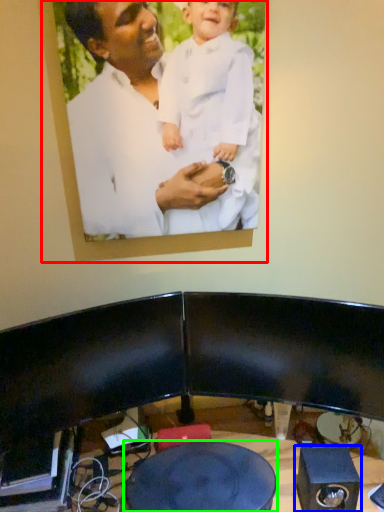
Question: Considering the real-world distances, which object is closest to picture frame (highlighted by a red box)? speaker (highlighted by a blue box) or round table (highlighted by a green box).

Choices:
 (A) speaker
 (B) round table

Answer: (B)